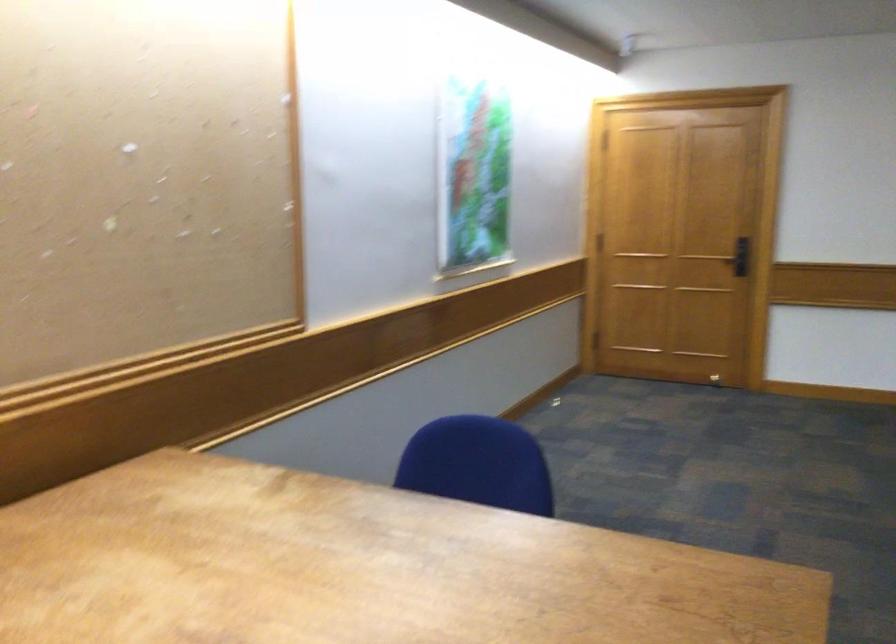
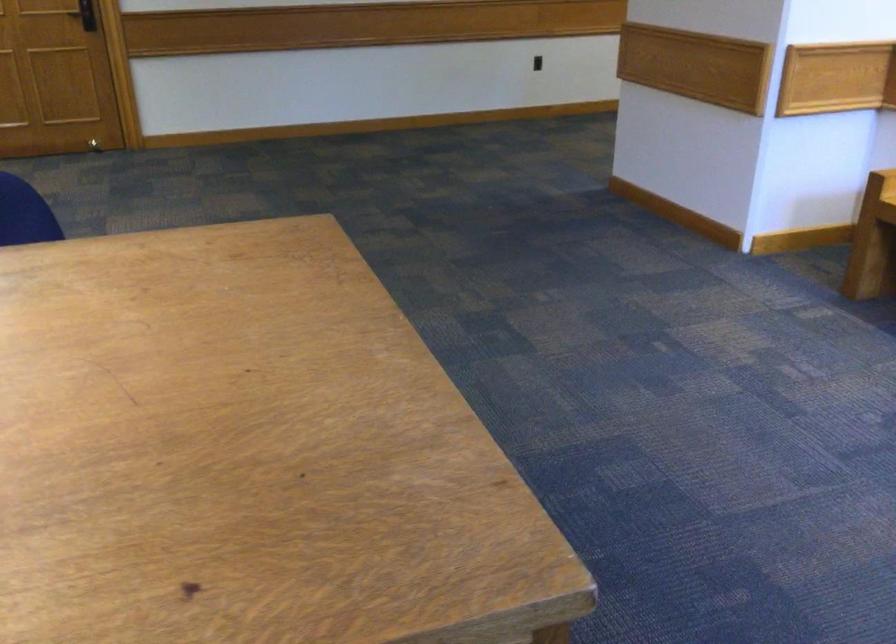
Locate, in the second image, the point that corresponds to point (636, 266) in the first image.

(85, 15)